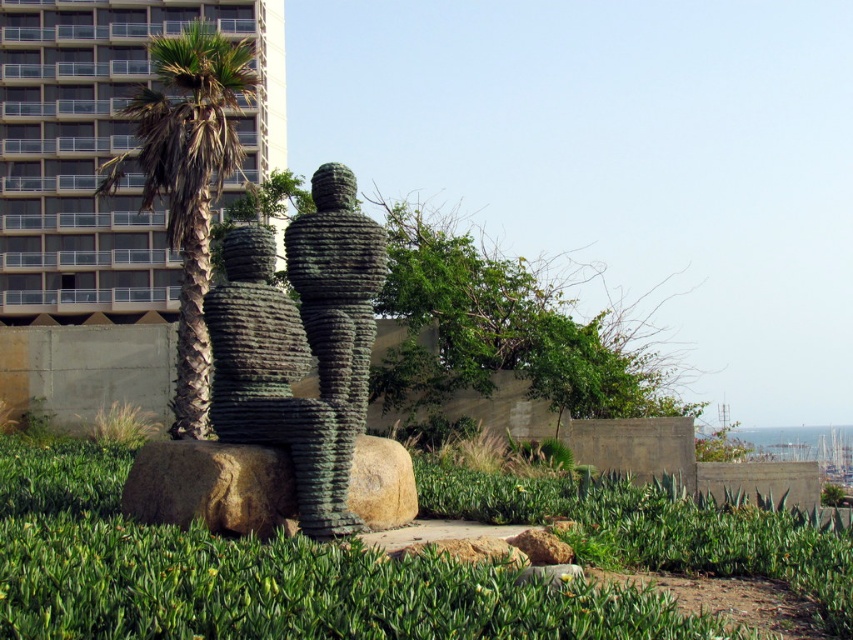
Question: Which point is closer to the camera taking this photo?

Choices:
 (A) (73, 108)
 (B) (57, 476)
 (C) (289, 340)

Answer: (C)

Question: Does gray concrete building at upper left appear under green textured palm tree at left?

Choices:
 (A) yes
 (B) no

Answer: (B)

Question: Does green textured stone sculpture at center have a greater width compared to green textured palm tree at left?

Choices:
 (A) yes
 (B) no

Answer: (B)

Question: Which object appears closest to the camera in this image?

Choices:
 (A) green textured palm tree at left
 (B) green leafy grass at center
 (C) green textured stone sculpture at center

Answer: (B)

Question: Which point is farther to the camera?

Choices:
 (A) green textured palm tree at left
 (B) green leafy grass at center
 (C) gray concrete building at upper left

Answer: (C)

Question: Is gray concrete building at upper left further to the viewer compared to green textured stone sculpture at center?

Choices:
 (A) no
 (B) yes

Answer: (B)